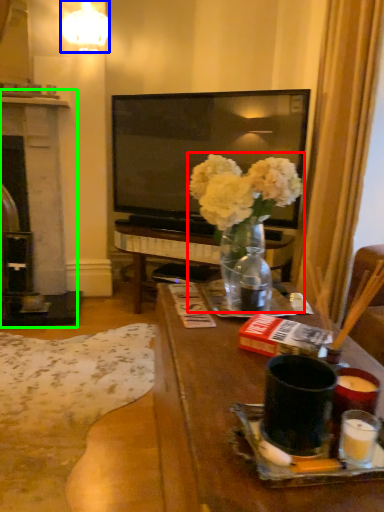
Question: Which object is positioned farthest from floral arrangement (highlighted by a red box)? Select from lamp (highlighted by a blue box) and fireplace (highlighted by a green box).

Choices:
 (A) lamp
 (B) fireplace

Answer: (A)